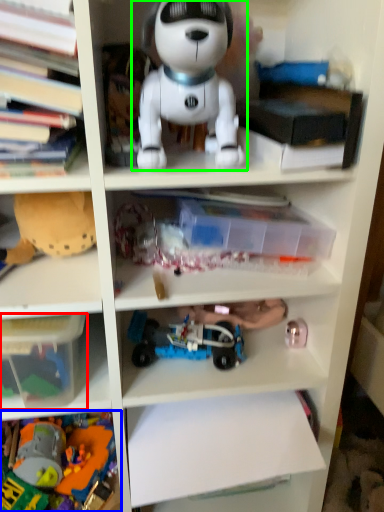
Question: Based on their relative distances, which object is farther from storage box (highlighted by a red box)? Choose from toy (highlighted by a blue box) and toy (highlighted by a green box).

Choices:
 (A) toy
 (B) toy

Answer: (B)